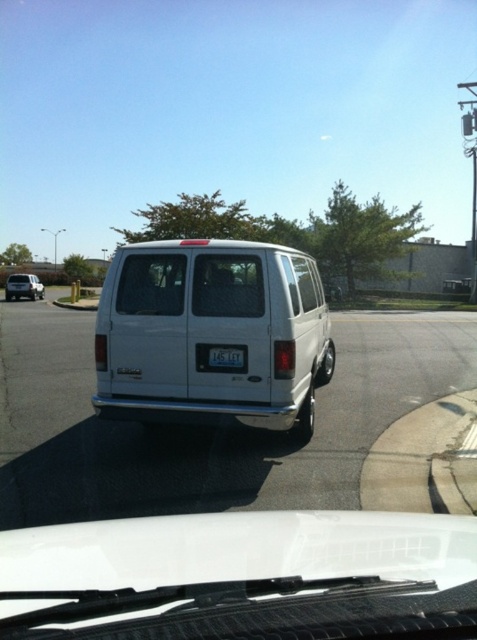
You are a delivery driver who needs to check if the transparent glass windshield at rear and the white plastic license plate at center are visible from your current position. Which object is closer to you?

The transparent glass windshield at rear is closer to you than the white plastic license plate at center because it is further to the viewer.

You are a delivery driver who needs to park your white matte van at center between two other vans. The van on the left is the white matte van at left. Based on their sizes, which van should you consider for the parking space in terms of height?

The white matte van at center is much taller than the white matte van at left, so you should consider the white matte van at left for the parking space since it is shorter and less likely to cause height issues.

Looking at this image, you are driving a car and want to park behind the white matte van at center. The parking space behind it is 5.5 meters long. Can the van fit into the space?

The white matte van at center is 5.12 meters from viewer. Since the parking space is 5.5 meters long, the van can fit into the space as its length is shorter than the available space.